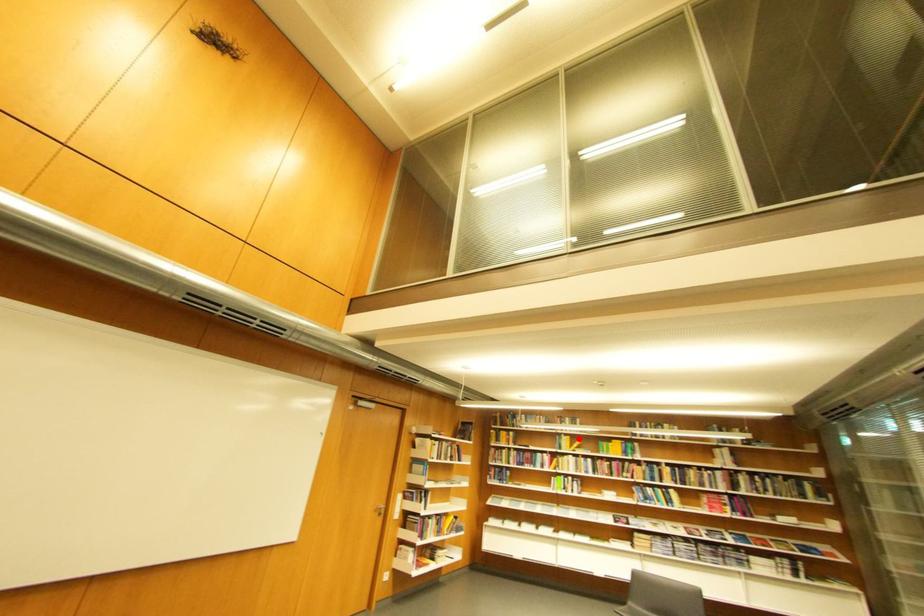
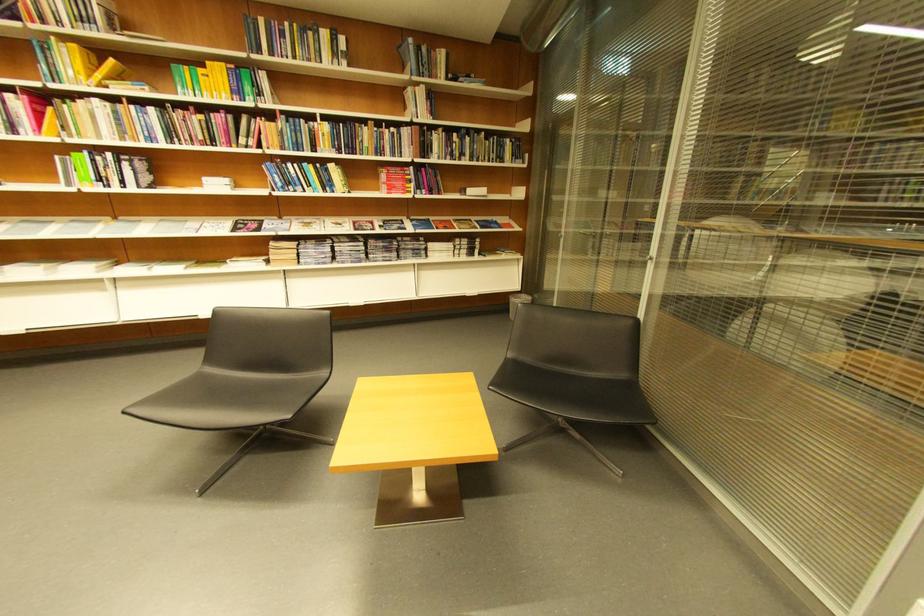
The point at the highlighted location is marked in the first image. Where is the corresponding point in the second image?

(84, 47)